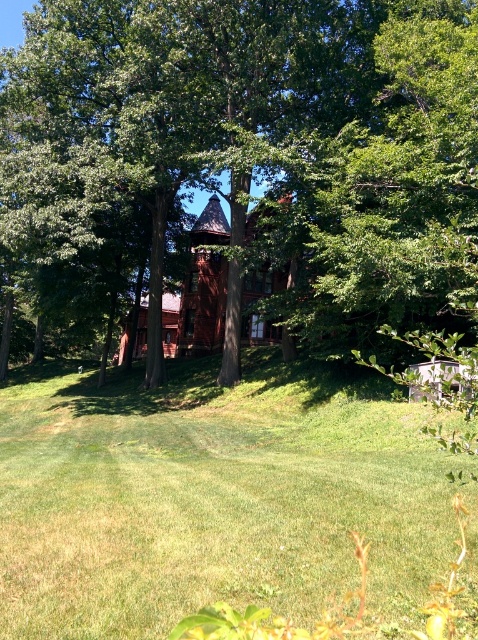
You are standing in the middle of the grassy area and want to walk towards the green leafy tree at center. Which direction should you walk?

Walk towards the point at coordinates 0.220 on the x axis and 0.546 on the y axis, which is the location of the green leafy tree at center.

You are standing in the middle of the green grass at center and want to see the red wood chapel at center. In which direction should you look?

You should look upward because the green grass at center is below the red wood chapel at center.